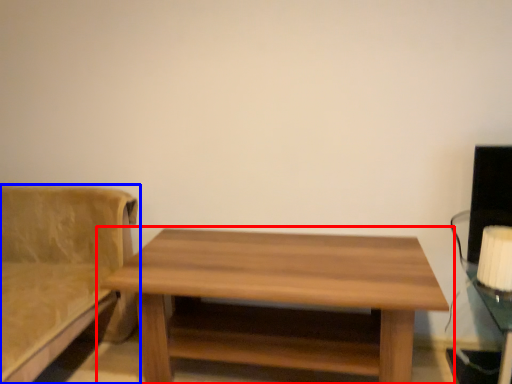
Question: Which object is further to the camera taking this photo, table (highlighted by a red box) or studio couch (highlighted by a blue box)?

Choices:
 (A) table
 (B) studio couch

Answer: (A)